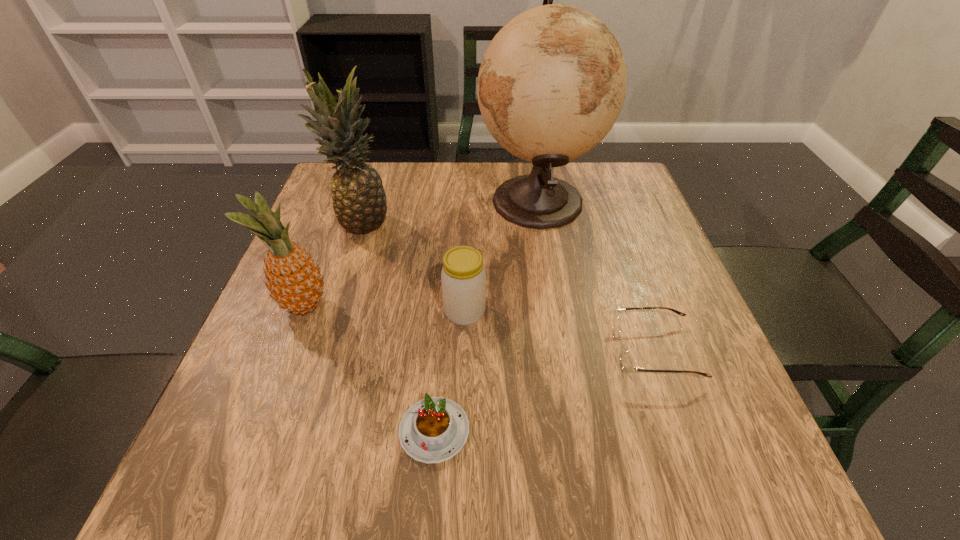
Where is `vacant space located on the front-facing side of the tallest object`? vacant space located on the front-facing side of the tallest object is located at coordinates [354, 200].

Where is `blank space located on the front-facing side of the tallest object`? This screenshot has width=960, height=540. blank space located on the front-facing side of the tallest object is located at coordinates (440, 200).

What are the coordinates of `vacant space located on the right of the fifth shortest object` in the screenshot? It's located at (539, 222).

At what (x,y) coordinates should I click in order to perform the action: click on blank area located 0.100m on the back of the nearer pineapple. Please return your answer as a coordinate pair (x, y). This screenshot has width=960, height=540. Looking at the image, I should click on (323, 256).

Where is `free space located 0.200m on the right of the fourth tallest object`? free space located 0.200m on the right of the fourth tallest object is located at coordinates (584, 312).

Identify the location of vacant space located 0.160m on the front-facing side of the spectacles. (529, 351).

Locate an element on the screen. This screenshot has height=540, width=960. vacant space positioned on the front-facing side of the spectacles is located at coordinates (540, 351).

What are the coordinates of `free space located on the front-facing side of the spectacles` in the screenshot? It's located at (540, 351).

You are a GUI agent. You are given a task and a screenshot of the screen. Output one action in this format:
    pyautogui.click(x=<x>, y=<y>)
    Task: Click on the free space located 0.070m on the right of the shortest object
    The width and height of the screenshot is (960, 540).
    Given the screenshot: What is the action you would take?
    [513, 431]

You are a GUI agent. You are given a task and a screenshot of the screen. Output one action in this format:
    pyautogui.click(x=<x>, y=<y>)
    Task: Click on the globe present at the far edge
    
    Given the screenshot: What is the action you would take?
    pyautogui.click(x=552, y=83)